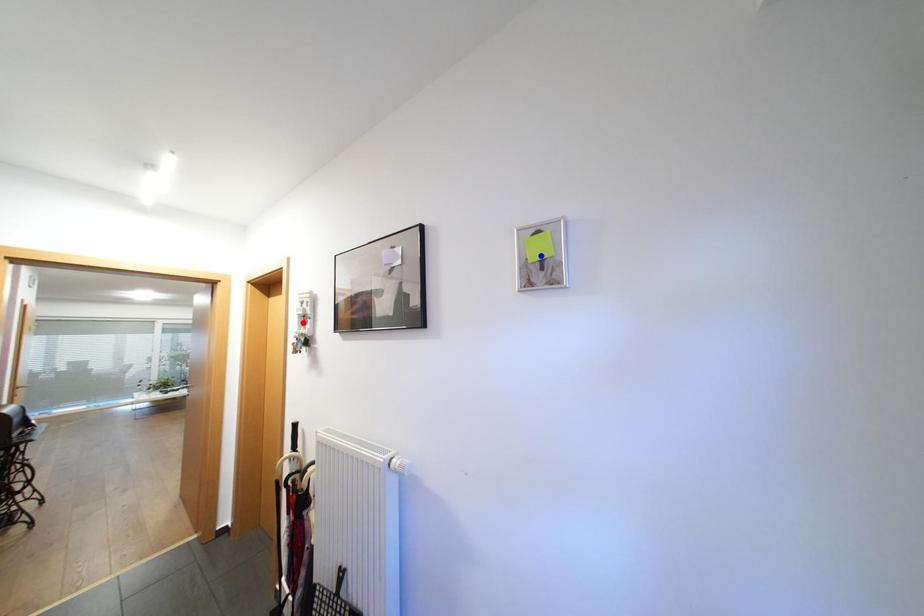
Question: In the image, two points are highlighted. Which point is nearer to the camera? Reply with the corresponding letter.

Choices:
 (A) blue point
 (B) red point

Answer: (A)